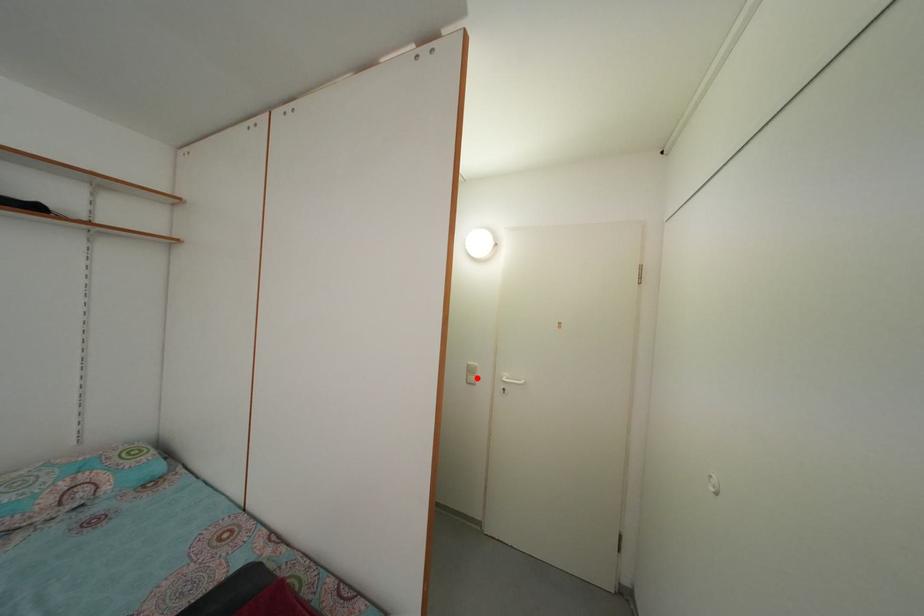
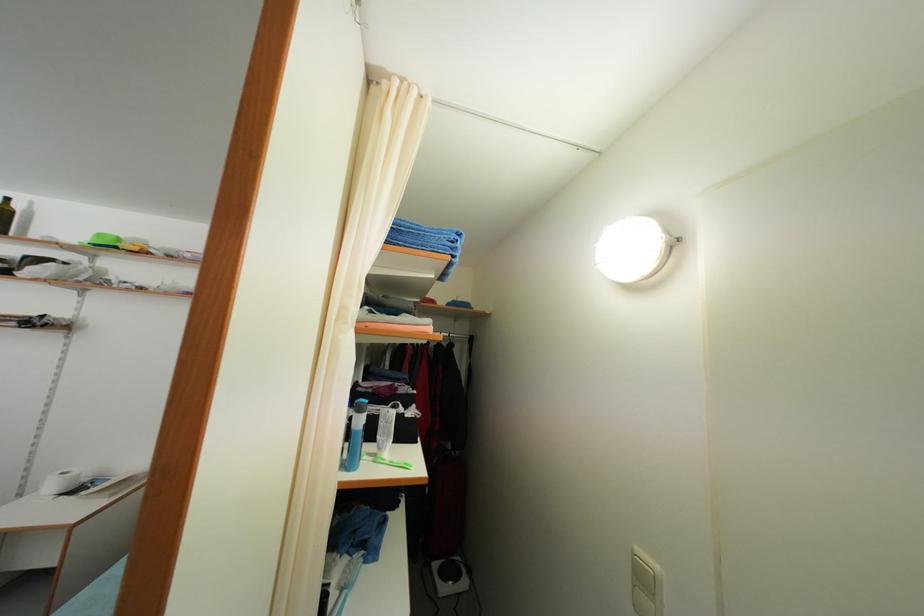
Find the pixel in the second image that matches the highlighted location in the first image.

(649, 586)